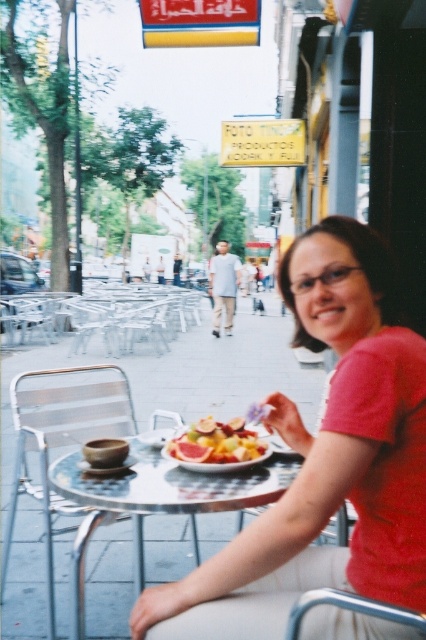
Question: Which object is closer to the camera taking this photo?

Choices:
 (A) juicy pink grapefruit at center
 (B) clear glass table at center

Answer: (B)

Question: Considering the relative positions of clear glass table at center and juicy pink grapefruit at center in the image provided, where is clear glass table at center located with respect to juicy pink grapefruit at center?

Choices:
 (A) left
 (B) right

Answer: (A)

Question: Which of the following is the farthest from the observer?

Choices:
 (A) matte red shirt at center
 (B) silver metallic chair at lower left
 (C) clear glass table at center

Answer: (B)

Question: Can you confirm if silver metallic chair at lower left is positioned to the right of clear glass table at center?

Choices:
 (A) no
 (B) yes

Answer: (A)

Question: Which point is closer to the camera?

Choices:
 (A) silver metallic chair at lower left
 (B) clear glass table at center
 (C) matte red shirt at center

Answer: (C)

Question: In this image, where is silver metallic chair at lower left located relative to juicy pink grapefruit at center?

Choices:
 (A) below
 (B) above

Answer: (A)